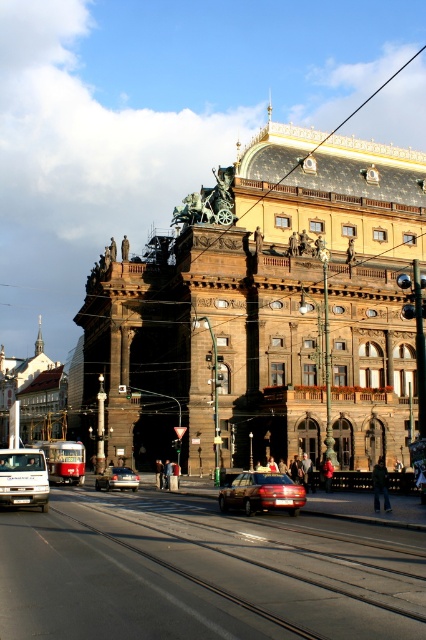
You are a photographer planning to capture the grand building in the image. You want to ensure that both the shiny red sedan at center and the white matte van at lower left are visible in your shot. Given their heights, which vehicle should you position closer to the camera to avoid blocking the view of the building?

The shiny red sedan at center is shorter than the white matte van at lower left. To avoid blocking the building, position the taller white matte van at lower left farther from the camera and the shorter shiny red sedan at center closer.

You are standing in front of the grand historic building and want to locate two specific points on its facade. The first point is at coordinate point (270, 508) and the second is at point (42, 499). Which of these two points is nearer to you?

Point (270, 508) is closer to the viewer than point (42, 499).